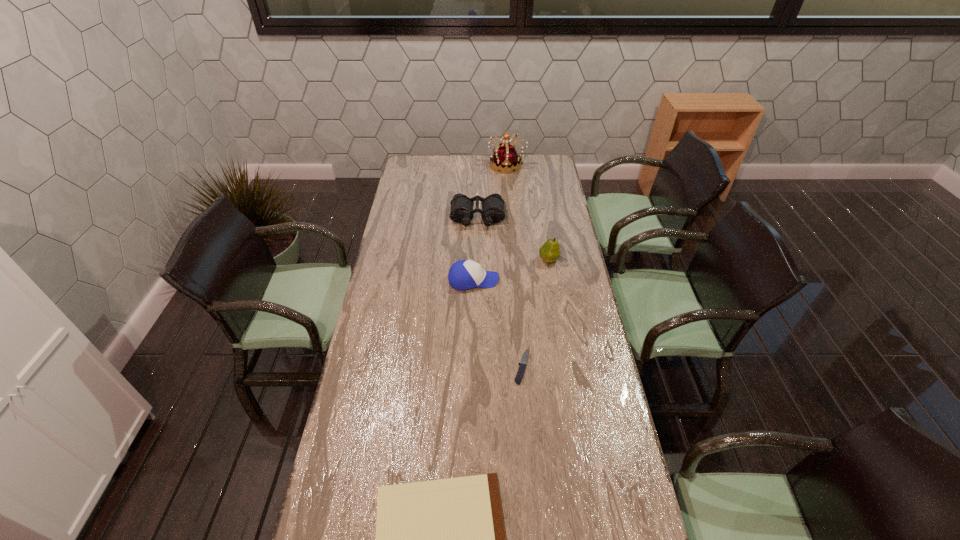
Find the location of a particular element. Image resolution: width=960 pixels, height=540 pixels. free space located on the front-facing side of the tiara is located at coordinates (433, 165).

Locate an element on the screen. The image size is (960, 540). vacant space situated 0.170m on the left of the fifth shortest object is located at coordinates pyautogui.click(x=499, y=260).

The height and width of the screenshot is (540, 960). Find the location of `vacant area situated through the eyepieces of the fifth nearest object`. vacant area situated through the eyepieces of the fifth nearest object is located at coordinates (477, 256).

This screenshot has height=540, width=960. What are the coordinates of `vacant region located on the front-facing side of the baseball cap` in the screenshot? It's located at (549, 280).

This screenshot has width=960, height=540. I want to click on free location located 0.230m on the right of the steak knife, so click(x=598, y=367).

Find the location of a particular element. The image size is (960, 540). object that is at the far edge is located at coordinates (506, 159).

Find the location of a particular element. object located in the right edge section of the desktop is located at coordinates (550, 252).

The width and height of the screenshot is (960, 540). I want to click on free space at the far edge of the desktop, so click(x=476, y=170).

At what (x,y) coordinates should I click in order to perform the action: click on free space at the left edge of the desktop. Please return your answer as a coordinate pair (x, y). This screenshot has width=960, height=540. Looking at the image, I should click on (386, 268).

In the image, there is a desktop. Identify the location of vacant space at the right edge. The width and height of the screenshot is (960, 540). (558, 180).